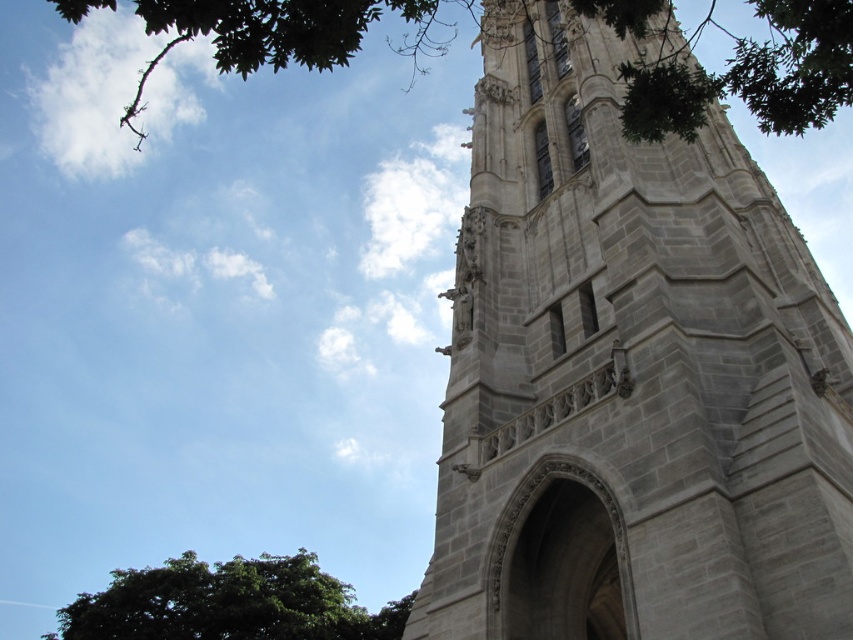
Question: Which object appears closest to the camera in this image?

Choices:
 (A) green leafy tree at upper left
 (B) green leafy tree at lower left

Answer: (A)

Question: Which object appears farthest from the camera in this image?

Choices:
 (A) green leafy tree at lower left
 (B) green leafy tree at upper left

Answer: (A)

Question: Is green leafy tree at upper left bigger than green leafy tree at lower left?

Choices:
 (A) no
 (B) yes

Answer: (B)

Question: Does gray stone tower at center appear over green leafy tree at upper left?

Choices:
 (A) no
 (B) yes

Answer: (A)

Question: Does green leafy tree at upper left appear under green leafy tree at lower left?

Choices:
 (A) yes
 (B) no

Answer: (B)

Question: Among these points, which one is nearest to the camera?

Choices:
 (A) (339, 54)
 (B) (165, 600)
 (C) (573, 588)

Answer: (A)